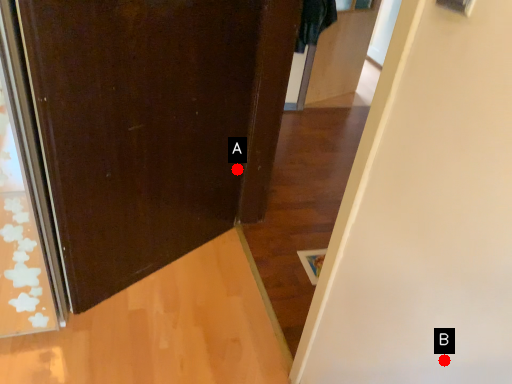
Question: Two points are circled on the image, labeled by A and B beside each circle. Which point is closer to the camera?

Choices:
 (A) A is closer
 (B) B is closer

Answer: (B)